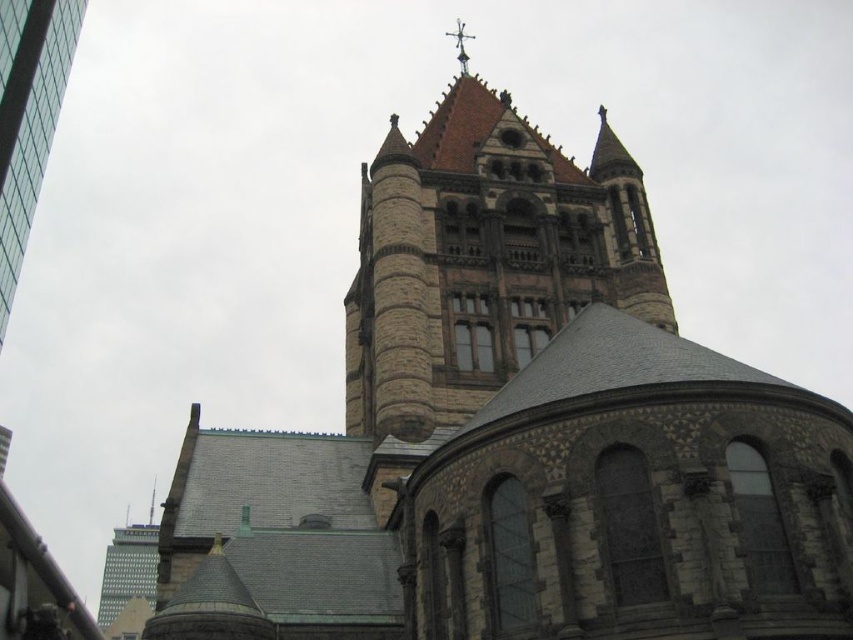
Question: In this image, where is brown stone tower at upper center located relative to gray concrete skyscraper at lower left?

Choices:
 (A) above
 (B) below

Answer: (A)

Question: Is glassy steel skyscraper at upper left further to the viewer compared to gray concrete skyscraper at lower left?

Choices:
 (A) yes
 (B) no

Answer: (B)

Question: Among these objects, which one is nearest to the camera?

Choices:
 (A) brown stone tower at upper center
 (B) glassy steel skyscraper at upper left
 (C) gray concrete skyscraper at lower left

Answer: (A)

Question: Estimate the real-world distances between objects in this image. Which object is closer to the brown stone tower at upper center?

Choices:
 (A) glassy steel skyscraper at upper left
 (B) gray concrete skyscraper at lower left

Answer: (A)

Question: Does brown stone tower at upper center come in front of gray concrete skyscraper at lower left?

Choices:
 (A) yes
 (B) no

Answer: (A)

Question: Which point is farther from the camera taking this photo?

Choices:
 (A) (4, 200)
 (B) (105, 554)
 (C) (498, 170)

Answer: (B)